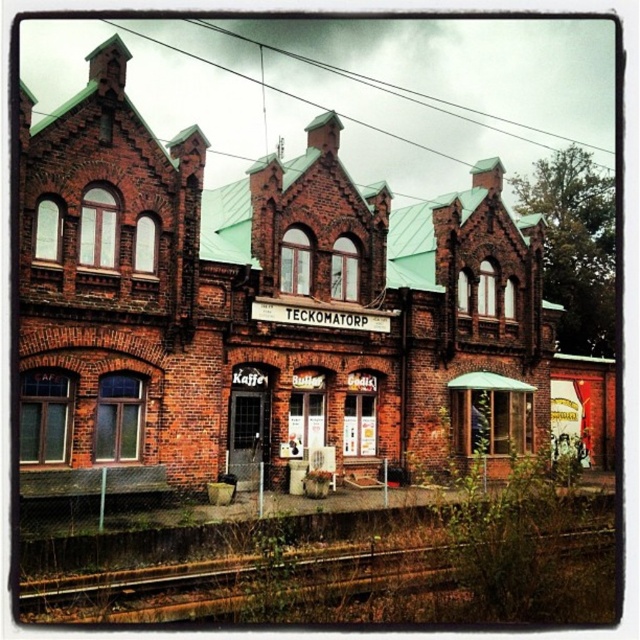
You are standing at the entrance of the brick building at center and want to see the rusty metal train track at lower left. Which object is taller when viewed from this position?

The brick building at center is taller than the rusty metal train track at lower left, so when viewed from the entrance, the brick building at center appears taller.

You are an architect analyzing the symmetry of the brick building at center and the rusty metal train track at lower left. Which object has a greater width?

The brick building at center has a greater width than the rusty metal train track at lower left.